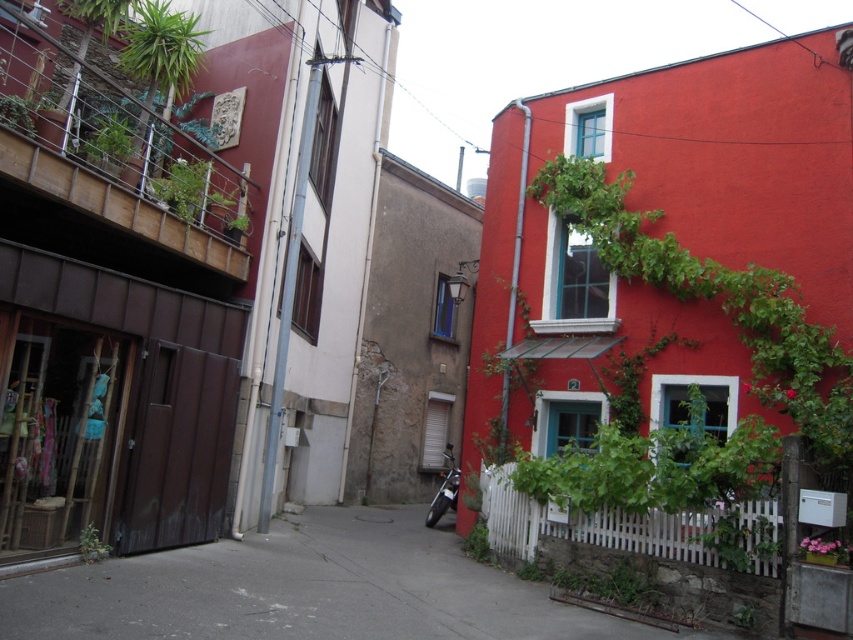
You are a delivery person carrying a box that is 1 meter tall. You need to walk through the alleyway shown in the image. Is there enough vertical space between the gray concrete pavement at lower center and the green leafy plant at lower center for your box to pass through without hitting anything?

The gray concrete pavement at lower center has a greater height compared to green leafy plant at lower center. Since the box is 1 meter tall, as long as the height of the gray concrete pavement at lower center is more than 1 meter, the box can pass. However, the exact height isn

You are standing in the alleyway between the two buildings. You see two points marked in the scene. Which point is closer to you, point (215, 576) or point (479, 545)?

Point (215, 576) is in front of point (479, 545), so it is closer to you.

You are a delivery person with a cart that is 5 meters long. You need to move through the alleyway shown in the image. Is your cart able to fit through the narrowest part of the alleyway between the gray concrete pavement at lower center and the building on the left?

The narrowest part of the alleyway between the gray concrete pavement at lower center and the building on the left is 4.90 meters apart. Since the cart is 5 meters long, it cannot fit through this space as it is slightly wider than the available width.